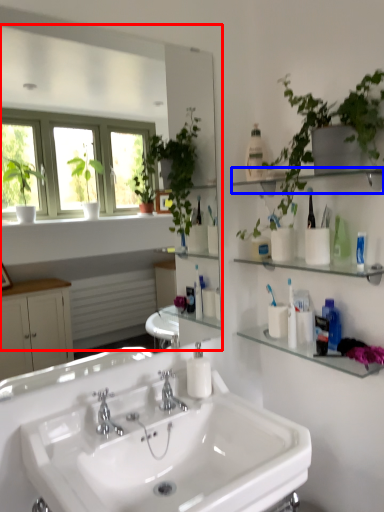
Question: Which point is further to the camera, mirror (highlighted by a red box) or shelf (highlighted by a blue box)?

Choices:
 (A) mirror
 (B) shelf

Answer: (B)